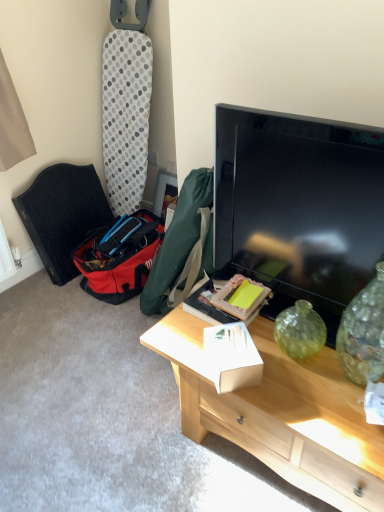
Where is `vacant space to the right of white cardboard box at center, arranged as the first box when viewed from the front`? This screenshot has height=512, width=384. vacant space to the right of white cardboard box at center, arranged as the first box when viewed from the front is located at coordinates (304, 388).